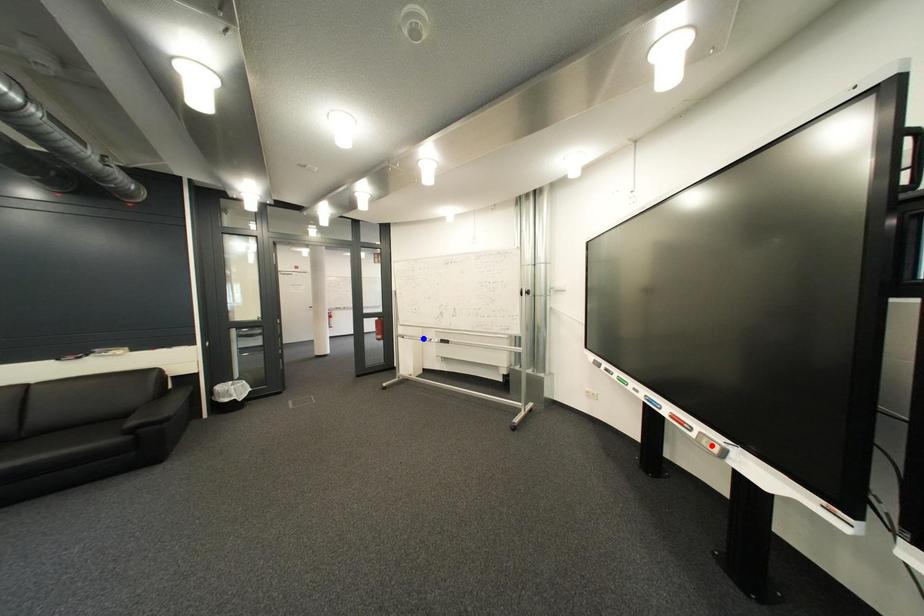
Question: In the image, two points are highlighted. Which point is nearer to the camera? Reply with the corresponding letter.

Choices:
 (A) blue point
 (B) red point

Answer: (B)